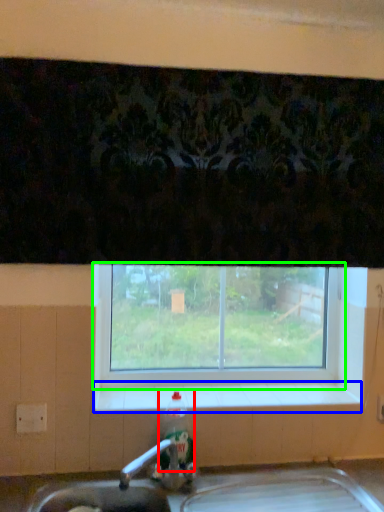
Question: Which object is the closest to the bottle (highlighted by a red box)? Choose among these: window sill (highlighted by a blue box) or window (highlighted by a green box).

Choices:
 (A) window sill
 (B) window

Answer: (A)